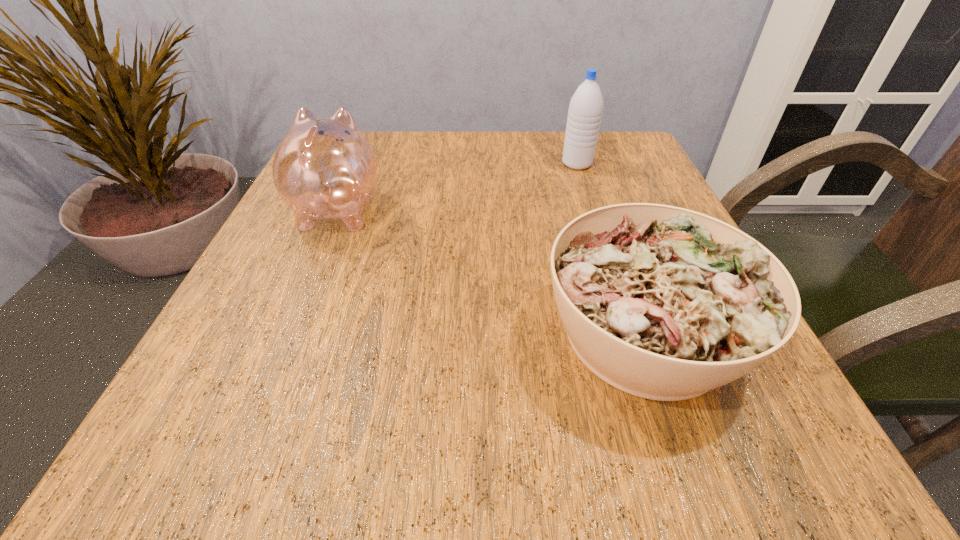
This screenshot has width=960, height=540. I want to click on piggy bank that is at the far edge, so click(x=324, y=168).

Image resolution: width=960 pixels, height=540 pixels. In order to click on object that is positioned at the near edge in this screenshot , I will do `click(664, 303)`.

Where is `object that is positioned at the left edge`? object that is positioned at the left edge is located at coordinates (324, 168).

Locate an element on the screen. The image size is (960, 540). water bottle located at the right edge is located at coordinates (585, 110).

Find the location of a particular element. Image resolution: width=960 pixels, height=540 pixels. salad that is at the right edge is located at coordinates (664, 303).

The image size is (960, 540). Identify the location of object that is at the far left corner. (324, 168).

I want to click on object that is at the far right corner, so click(x=585, y=110).

Find the location of `object present at the near right corner`. object present at the near right corner is located at coordinates (664, 303).

At what (x,y) coordinates should I click in order to perform the action: click on vacant position at the far edge of the desktop. Please return your answer as a coordinate pair (x, y). The height and width of the screenshot is (540, 960). Looking at the image, I should click on (500, 135).

This screenshot has width=960, height=540. In the image, there is a desktop. Identify the location of free space at the near edge. (647, 407).